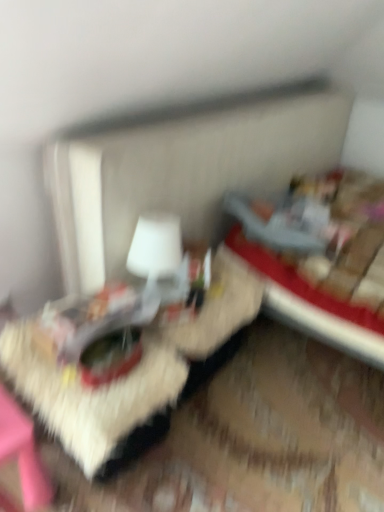
Describe the element at coordinates (160, 257) in the screenshot. This screenshot has height=512, width=384. I see `white matte table lamp at center` at that location.

Identify the location of velvet red bed at right. The image size is (384, 512). (320, 257).

Locate an element on the screen. This screenshot has height=512, width=384. white matte table lamp at center is located at coordinates (160, 257).

Is wooden textured table at center inside or outside of velvet red bed at right?

wooden textured table at center is not inside velvet red bed at right, it's outside.

From a real-world perspective, is wooden textured table at center over velvet red bed at right?

No, from a real-world perspective, wooden textured table at center is not above velvet red bed at right.

Does wooden textured table at center have a larger size compared to velvet red bed at right?

No.

Which is more to the left, wooden textured table at center or velvet red bed at right?

From the viewer's perspective, wooden textured table at center appears more on the left side.

Considering the sizes of objects velvet red bed at right and white matte table lamp at center in the image provided, who is bigger, velvet red bed at right or white matte table lamp at center?

Bigger between the two is velvet red bed at right.

Considering their positions, is velvet red bed at right located in front of or behind white matte table lamp at center?

Clearly, velvet red bed at right is in front of white matte table lamp at center.

From the image's perspective, does velvet red bed at right appear higher than white matte table lamp at center?

Correct, velvet red bed at right appears higher than white matte table lamp at center in the image.

Is point (310, 222) behind point (143, 249)?

Yes, point (310, 222) is farther from viewer.

From a real-world perspective, is wooden textured table at center on white matte table lamp at center?

No, from a real-world perspective, wooden textured table at center is not over white matte table lamp at center

Which of these two, wooden textured table at center or white matte table lamp at center, stands shorter?

wooden textured table at center.

Considering the sizes of objects wooden textured table at center and white matte table lamp at center in the image provided, who is smaller, wooden textured table at center or white matte table lamp at center?

Smaller between the two is white matte table lamp at center.

Visually, is wooden textured table at center positioned to the left or to the right of white matte table lamp at center?

Clearly, wooden textured table at center is on the right of white matte table lamp at center in the image.

Which is more to the right, white matte table lamp at center or velvet red bed at right?

Positioned to the right is velvet red bed at right.

Can you tell me how much white matte table lamp at center and velvet red bed at right differ in facing direction?

There is a 5.69-degree angle between the facing directions of white matte table lamp at center and velvet red bed at right.

From a real-world perspective, which is physically above, white matte table lamp at center or velvet red bed at right?

white matte table lamp at center, from a real-world perspective.

Considering their positions, is velvet red bed at right located in front of or behind wooden textured table at center?

Clearly, velvet red bed at right is behind wooden textured table at center.

Can you confirm if velvet red bed at right is taller than wooden textured table at center?

Yes.

Is the surface of velvet red bed at right in direct contact with wooden textured table at center?

No.

From a real-world perspective, which object rests below the other?

wooden textured table at center, from a real-world perspective.

Looking at the image, does white matte table lamp at center seem bigger or smaller compared to wooden textured table at center?

Clearly, white matte table lamp at center is smaller in size than wooden textured table at center.

Is white matte table lamp at center inside the boundaries of wooden textured table at center, or outside?

white matte table lamp at center is not inside wooden textured table at center, it's outside.

Does white matte table lamp at center have a lesser width compared to wooden textured table at center?

Yes.

Where is `table lying below the velvet red bed at right (from the image's perspective)`? The image size is (384, 512). table lying below the velvet red bed at right (from the image's perspective) is located at coordinates (126, 366).

Find the location of `table lamp that appears above the velvet red bed at right (from a real-world perspective)`. table lamp that appears above the velvet red bed at right (from a real-world perspective) is located at coordinates (160, 257).

Which object lies further to the anchor point wooden textured table at center, white matte table lamp at center or velvet red bed at right?

The object further to wooden textured table at center is velvet red bed at right.

Looking at the image, which one is located further to wooden textured table at center, velvet red bed at right or white matte table lamp at center?

Based on the image, velvet red bed at right appears to be further to wooden textured table at center.

From the image, which object appears to be farther from velvet red bed at right, wooden textured table at center or white matte table lamp at center?

white matte table lamp at center lies further to velvet red bed at right than the other object.

When comparing their distances from velvet red bed at right, does white matte table lamp at center or wooden textured table at center seem further?

white matte table lamp at center is positioned further to the anchor velvet red bed at right.

Looking at the image, which one is located closer to white matte table lamp at center, wooden textured table at center or velvet red bed at right?

Among the two, wooden textured table at center is located nearer to white matte table lamp at center.

Looking at the image, which one is located closer to white matte table lamp at center, velvet red bed at right or wooden textured table at center?

The object closer to white matte table lamp at center is wooden textured table at center.

Image resolution: width=384 pixels, height=512 pixels. What are the coordinates of `table between white matte table lamp at center and velvet red bed at right from left to right` in the screenshot? It's located at (126, 366).